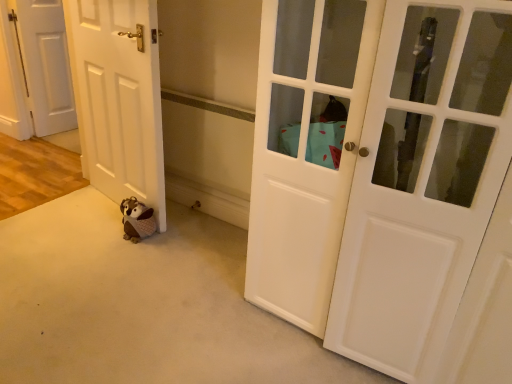
Measure the distance between white matte door at left, arranged as the 2th door when viewed from the left, and camera.

white matte door at left, arranged as the 2th door when viewed from the left, and camera are 1.76 meters apart from each other.

At what (x,y) coordinates should I click in order to perform the action: click on white glossy door at center, which is counted as the 3th door, starting from the back. Please return your answer as a coordinate pair (x, y). This screenshot has height=384, width=512. Looking at the image, I should click on [377, 169].

Identify the location of plush brown bear at lower left. The width and height of the screenshot is (512, 384). (137, 220).

Are white matte door at left, the 2th door positioned from the right, and white matte door at left, the 1th door in the left-to-right sequence, located far from each other?

Absolutely, white matte door at left, the 2th door positioned from the right, is distant from white matte door at left, the 1th door in the left-to-right sequence.

From the picture: Is white matte door at left, the 2th door positioned from the right, to the left of white matte door at left, which ranks as the third door in front-to-back order, from the viewer's perspective?

No, white matte door at left, the 2th door positioned from the right, is not to the left of white matte door at left, which ranks as the third door in front-to-back order.

Does white matte door at left, the second door in the back-to-front sequence, have a lesser height compared to plush brown bear at lower left?

Incorrect, the height of white matte door at left, the second door in the back-to-front sequence, does not fall short of that of plush brown bear at lower left.

Which object is thinner, white matte door at left, the 2th door positioned from the right, or plush brown bear at lower left?

white matte door at left, the 2th door positioned from the right, is thinner.

Between white matte door at left, arranged as the 2th door when viewed from the left, and plush brown bear at lower left, which one is positioned behind?

Positioned behind is plush brown bear at lower left.

Is white matte door at left, the second door in the back-to-front sequence, placed right next to plush brown bear at lower left?

No, white matte door at left, the second door in the back-to-front sequence, is not touching plush brown bear at lower left.

You are a GUI agent. You are given a task and a screenshot of the screen. Output one action in this format:
    pyautogui.click(x=<x>, y=<y>)
    Task: Click on the 2nd door positioned below the white matte door at left, the 1th door in the left-to-right sequence (from the image's perspective)
    This screenshot has height=384, width=512.
    Given the screenshot: What is the action you would take?
    tap(377, 169)

Is white glossy door at center, acting as the 1th door starting from the right, completely or partially outside of white matte door at left, the 1th door in the left-to-right sequence?

Yes, white glossy door at center, acting as the 1th door starting from the right, is outside of white matte door at left, the 1th door in the left-to-right sequence.

Between white glossy door at center, acting as the 1th door starting from the right, and white matte door at left, the first door when ordered from back to front, which one is positioned in front?

white glossy door at center, acting as the 1th door starting from the right, is in front.

Looking at this image, can you tell me how much white glossy door at center, acting as the 1th door starting from the right, and white matte door at left, which is the 3th door from right to left, differ in facing direction?

84.8 degrees separate the facing orientations of white glossy door at center, acting as the 1th door starting from the right, and white matte door at left, which is the 3th door from right to left.

Is there a large distance between white glossy door at center, placed as the 3th door when sorted from left to right, and white matte door at left, the 2th door positioned from the right?

Yes, white glossy door at center, placed as the 3th door when sorted from left to right, and white matte door at left, the 2th door positioned from the right, are located far from each other.

Consider the image. Visually, is white glossy door at center, which is counted as the 3th door, starting from the back, positioned to the left or to the right of white matte door at left, arranged as the 2th door when viewed from the left?

Clearly, white glossy door at center, which is counted as the 3th door, starting from the back, is on the right of white matte door at left, arranged as the 2th door when viewed from the left, in the image.

How many degrees apart are the facing directions of white glossy door at center, which is counted as the 3th door, starting from the back, and white matte door at left, arranged as the 2th door when viewed from the left?

They differ by 13.5 degrees in their facing directions.

Which is more distant, (469,196) or (155,191)?

Positioned behind is point (155,191).

Who is bigger, plush brown bear at lower left or white matte door at left, the first door when ordered from back to front?

Bigger between the two is white matte door at left, the first door when ordered from back to front.

Is plush brown bear at lower left at the left side of white matte door at left, the 1th door in the left-to-right sequence?

In fact, plush brown bear at lower left is to the right of white matte door at left, the 1th door in the left-to-right sequence.

Is plush brown bear at lower left inside or outside of white matte door at left, the first door when ordered from back to front?

plush brown bear at lower left cannot be found inside white matte door at left, the first door when ordered from back to front.

From their relative heights in the image, would you say white matte door at left, which ranks as the third door in front-to-back order, is taller or shorter than plush brown bear at lower left?

Considering their sizes, white matte door at left, which ranks as the third door in front-to-back order, has more height than plush brown bear at lower left.

Which object is wider, white matte door at left, which is the 3th door from right to left, or plush brown bear at lower left?

plush brown bear at lower left.

Which is behind, white matte door at left, the first door when ordered from back to front, or plush brown bear at lower left?

Positioned behind is white matte door at left, the first door when ordered from back to front.

Based on the photo, considering the relative sizes of white glossy door at center, acting as the 1th door starting from the right, and plush brown bear at lower left in the image provided, is white glossy door at center, acting as the 1th door starting from the right, smaller than plush brown bear at lower left?

No.

In the scene shown: Between white glossy door at center, placed as the 3th door when sorted from left to right, and plush brown bear at lower left, which one appears on the left side from the viewer's perspective?

From the viewer's perspective, plush brown bear at lower left appears more on the left side.

The width and height of the screenshot is (512, 384). In the image, there is a white glossy door at center, placed as the 1th door when sorted from front to back. In order to click on animal below it (from a real-world perspective) in this screenshot , I will do `click(137, 220)`.

Is white glossy door at center, which is counted as the 3th door, starting from the back, taller than plush brown bear at lower left?

Yes.

The height and width of the screenshot is (384, 512). Identify the location of door behind the white matte door at left, arranged as the second door when viewed from the front. tap(45, 64).

Where is `the 2nd door above the plush brown bear at lower left (from the image's perspective)`? the 2nd door above the plush brown bear at lower left (from the image's perspective) is located at coordinates (118, 97).

In the scene shown: Looking at the image, which one is located further to white matte door at left, which is the 3th door from right to left, white glossy door at center, acting as the 1th door starting from the right, or plush brown bear at lower left?

white glossy door at center, acting as the 1th door starting from the right.

Looking at the image, which one is located closer to white matte door at left, the second door in the back-to-front sequence, plush brown bear at lower left or white matte door at left, the first door when ordered from back to front?

plush brown bear at lower left lies closer to white matte door at left, the second door in the back-to-front sequence, than the other object.

Looking at the image, which one is located further to white matte door at left, the second door in the back-to-front sequence, white glossy door at center, placed as the 1th door when sorted from front to back, or white matte door at left, which is the 3th door from right to left?

white matte door at left, which is the 3th door from right to left.

Which object lies nearer to the anchor point plush brown bear at lower left, white matte door at left, the first door when ordered from back to front, or white matte door at left, the 2th door positioned from the right?

The object closer to plush brown bear at lower left is white matte door at left, the 2th door positioned from the right.

Estimate the real-world distances between objects in this image. Which object is further from white matte door at left, the 1th door in the left-to-right sequence, plush brown bear at lower left or white glossy door at center, which is counted as the 3th door, starting from the back?

white glossy door at center, which is counted as the 3th door, starting from the back.

Which object lies nearer to the anchor point plush brown bear at lower left, white matte door at left, the first door when ordered from back to front, or white glossy door at center, acting as the 1th door starting from the right?

Among the two, white glossy door at center, acting as the 1th door starting from the right, is located nearer to plush brown bear at lower left.

Based on their spatial positions, is white matte door at left, arranged as the 2th door when viewed from the left, or plush brown bear at lower left further from white matte door at left, which is the 3th door from right to left?

plush brown bear at lower left.

Based on their spatial positions, is white matte door at left, which is the 3th door from right to left, or white matte door at left, arranged as the second door when viewed from the front, further from white glossy door at center, placed as the 3th door when sorted from left to right?

white matte door at left, which is the 3th door from right to left, is positioned further to the anchor white glossy door at center, placed as the 3th door when sorted from left to right.

Where is `door positioned between white glossy door at center, which is counted as the 3th door, starting from the back, and white matte door at left, which ranks as the third door in front-to-back order, from near to far`? door positioned between white glossy door at center, which is counted as the 3th door, starting from the back, and white matte door at left, which ranks as the third door in front-to-back order, from near to far is located at coordinates point(118,97).

Where is `animal positioned between white glossy door at center, acting as the 1th door starting from the right, and white matte door at left, the first door when ordered from back to front, from near to far`? This screenshot has width=512, height=384. animal positioned between white glossy door at center, acting as the 1th door starting from the right, and white matte door at left, the first door when ordered from back to front, from near to far is located at coordinates (137, 220).

You are a GUI agent. You are given a task and a screenshot of the screen. Output one action in this format:
    pyautogui.click(x=<x>, y=<y>)
    Task: Click on the animal between white matte door at left, arranged as the 2th door when viewed from the left, and white matte door at left, the first door when ordered from back to front, along the z-axis
    The width and height of the screenshot is (512, 384).
    Given the screenshot: What is the action you would take?
    pyautogui.click(x=137, y=220)

The height and width of the screenshot is (384, 512). I want to click on door between white glossy door at center, placed as the 3th door when sorted from left to right, and plush brown bear at lower left from front to back, so pyautogui.click(x=118, y=97).